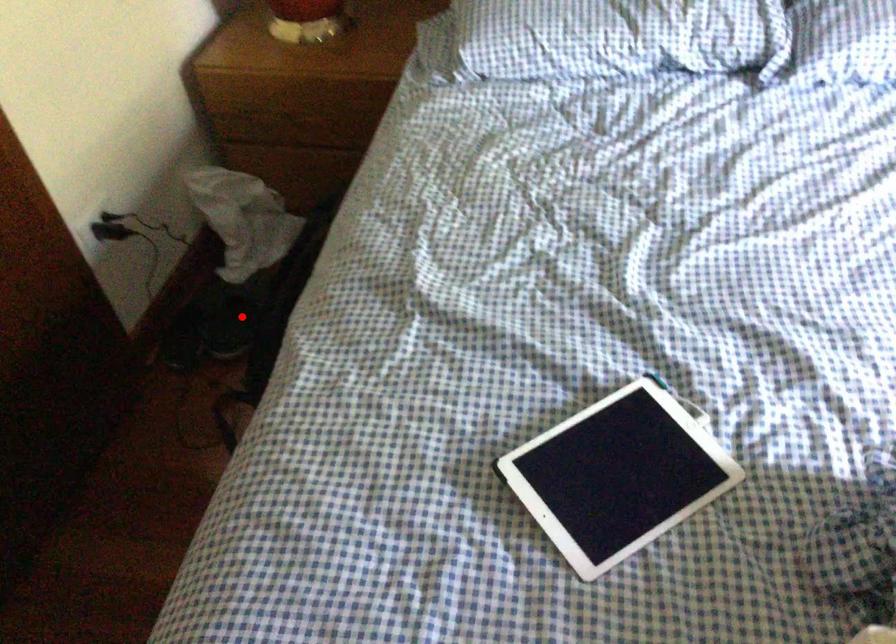
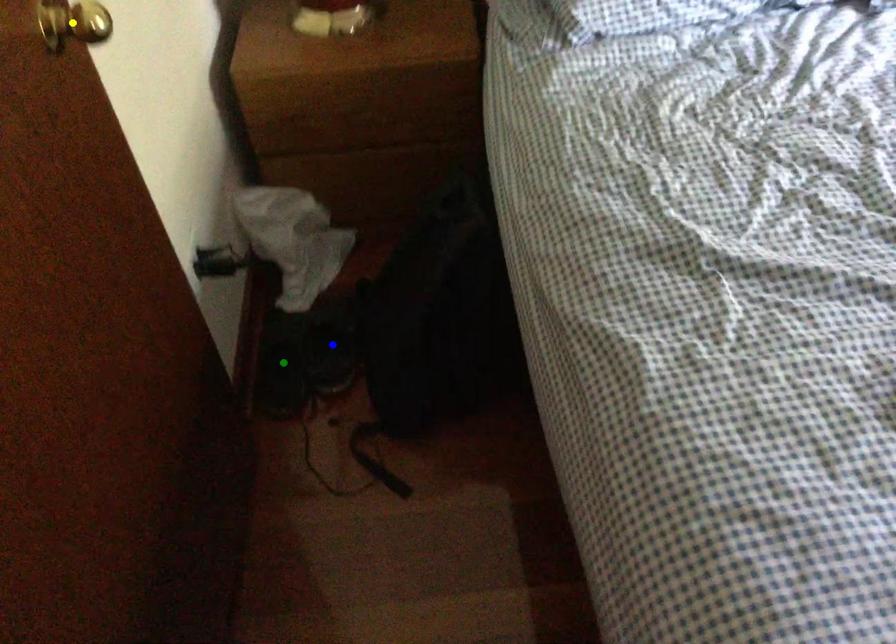
Question: I am providing you with two images of the same scene from different viewpoints. A red point is marked on the first image. You are given multiple points on the second image. Which mark in image 2 goes with the point in image 1?

Choices:
 (A) green point
 (B) blue point
 (C) yellow point

Answer: (B)